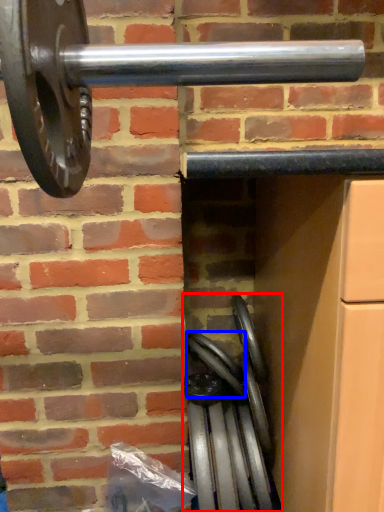
Question: Which object appears farthest to the camera in this image, wheel (highlighted by a red box) or wheel (highlighted by a blue box)?

Choices:
 (A) wheel
 (B) wheel

Answer: (B)